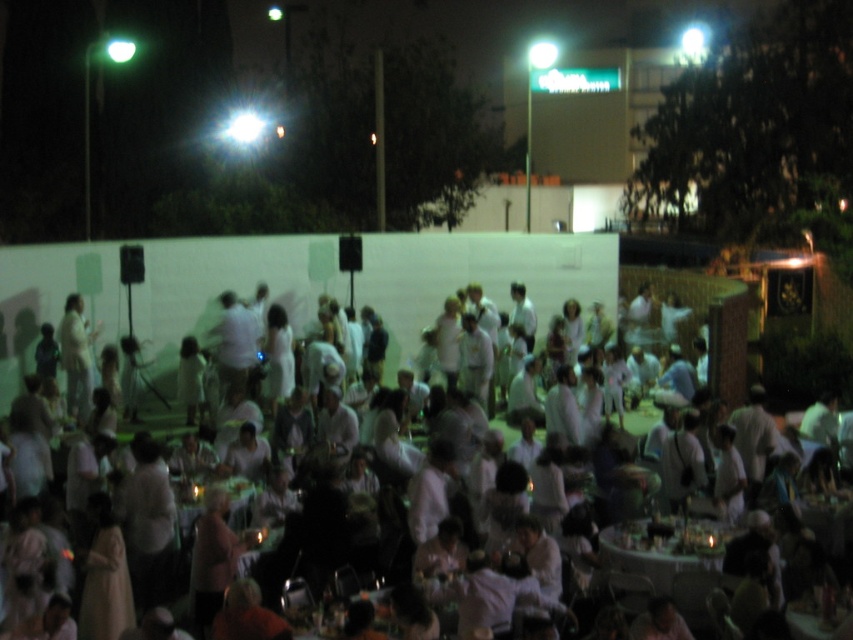
Question: From the image, what is the correct spatial relationship of white matte dress at center in relation to wooden round table at center?

Choices:
 (A) left
 (B) right

Answer: (A)

Question: Which of the following is the closest to the observer?

Choices:
 (A) white matte dress at center
 (B) wooden round table at center

Answer: (B)

Question: Can you confirm if white matte dress at center is positioned to the left of wooden round table at center?

Choices:
 (A) no
 (B) yes

Answer: (B)

Question: Is white matte dress at center bigger than wooden round table at center?

Choices:
 (A) no
 (B) yes

Answer: (B)